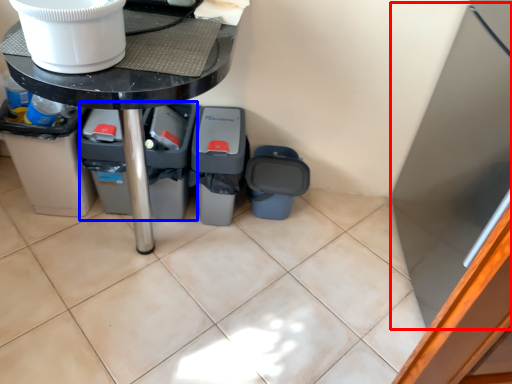
Question: Among these objects, which one is farthest to the camera, appliance (highlighted by a red box) or bin (highlighted by a blue box)?

Choices:
 (A) appliance
 (B) bin

Answer: (B)